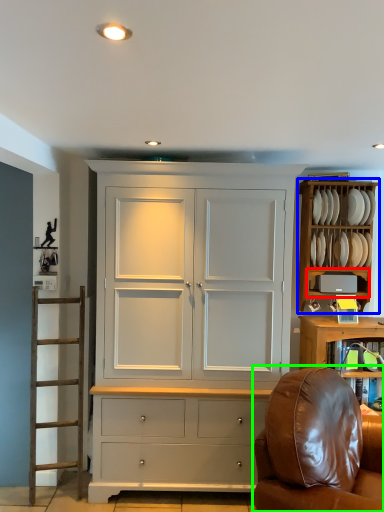
Question: Which object is positioned farthest from shelf (highlighted by a red box)? Select from cabinetry (highlighted by a blue box) and chair (highlighted by a green box).

Choices:
 (A) cabinetry
 (B) chair

Answer: (B)